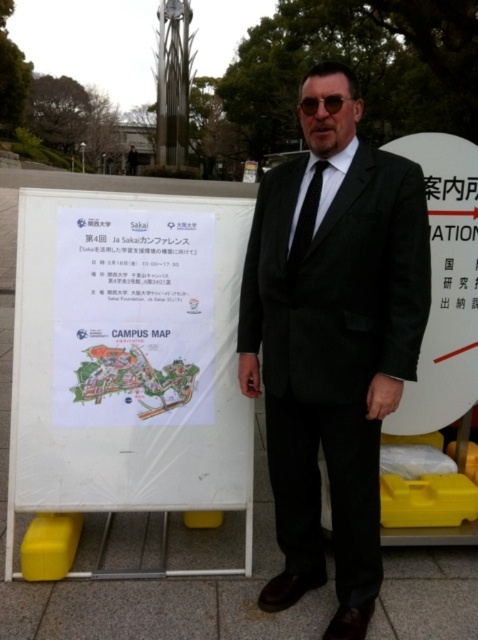
Question: Among these points, which one is farthest from the camera?

Choices:
 (A) (310, 196)
 (B) (440, 344)
 (C) (183, 436)

Answer: (B)

Question: Is white plastic signboard at center to the left of black silk tie at center from the viewer's perspective?

Choices:
 (A) yes
 (B) no

Answer: (A)

Question: Considering the real-world distances, which object is farthest from the white plastic sign at right?

Choices:
 (A) black silk tie at center
 (B) black matte suit at center

Answer: (B)

Question: Among these points, which one is farthest from the camera?

Choices:
 (A) (434, 419)
 (B) (296, 211)

Answer: (A)

Question: Observing the image, what is the correct spatial positioning of white plastic signboard at center in reference to black silk tie at center?

Choices:
 (A) above
 (B) below

Answer: (B)

Question: Does white plastic sign at right have a lesser width compared to black silk tie at center?

Choices:
 (A) no
 (B) yes

Answer: (A)